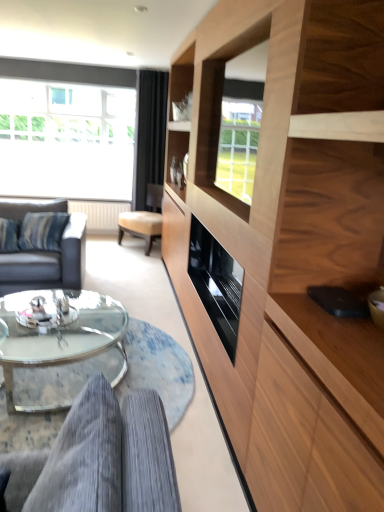
Question: Does transparent glass window at upper left have a smaller size compared to dark gray leather couch at left, arranged as the second studio couch when viewed from the front?

Choices:
 (A) yes
 (B) no

Answer: (B)

Question: Is transparent glass window at upper left facing away from dark gray leather couch at left, arranged as the second studio couch when viewed from the front?

Choices:
 (A) no
 (B) yes

Answer: (A)

Question: Is the position of transparent glass window at upper left more distant than that of dark gray leather couch at left, which is counted as the 2th studio couch, starting from the right?

Choices:
 (A) no
 (B) yes

Answer: (B)

Question: Is transparent glass window at upper left far away from dark gray leather couch at left, the 1th studio couch from the top?

Choices:
 (A) yes
 (B) no

Answer: (A)

Question: Considering the relative positions of transparent glass window at upper left and dark gray leather couch at left, arranged as the second studio couch when viewed from the front, in the image provided, is transparent glass window at upper left to the right of dark gray leather couch at left, arranged as the second studio couch when viewed from the front, from the viewer's perspective?

Choices:
 (A) yes
 (B) no

Answer: (B)

Question: Does transparent glass window at upper left turn towards dark gray leather couch at left, arranged as the second studio couch when viewed from the front?

Choices:
 (A) no
 (B) yes

Answer: (B)

Question: From the image's perspective, is dark gray leather couch at left, which appears as the second studio couch when ordered from the bottom, beneath gray corduroy couch at lower left, which ranks as the 2th studio couch in top-to-bottom order?

Choices:
 (A) yes
 (B) no

Answer: (B)

Question: Would you consider dark gray leather couch at left, which is counted as the 2th studio couch, starting from the right, to be distant from gray corduroy couch at lower left, the first studio couch in the front-to-back sequence?

Choices:
 (A) yes
 (B) no

Answer: (A)

Question: Is dark gray leather couch at left, the 1th studio couch from the top, thinner than gray corduroy couch at lower left, the first studio couch in the front-to-back sequence?

Choices:
 (A) yes
 (B) no

Answer: (B)

Question: From a real-world perspective, is dark gray leather couch at left, arranged as the second studio couch when viewed from the front, physically below gray corduroy couch at lower left, which ranks as the 2th studio couch in top-to-bottom order?

Choices:
 (A) yes
 (B) no

Answer: (A)

Question: Does dark gray leather couch at left, placed as the 1th studio couch when sorted from back to front, have a greater height compared to gray corduroy couch at lower left, arranged as the 2th studio couch when viewed from the left?

Choices:
 (A) yes
 (B) no

Answer: (A)

Question: Is dark gray leather couch at left, acting as the first studio couch starting from the left, wider than gray corduroy couch at lower left, which ranks as the 2th studio couch in top-to-bottom order?

Choices:
 (A) yes
 (B) no

Answer: (A)

Question: Is black velvet curtain at upper center facing away from gray corduroy couch at lower left, arranged as the 2th studio couch when viewed from the back?

Choices:
 (A) yes
 (B) no

Answer: (B)